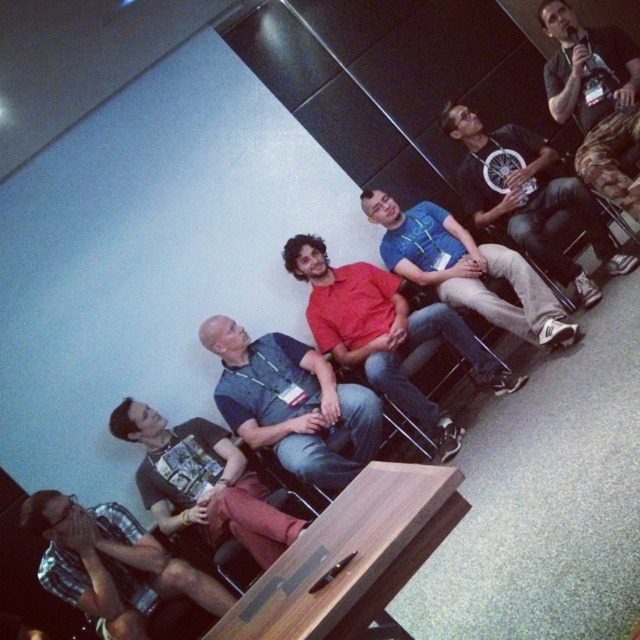
Question: Is dark gray shirt at center to the left of blue t-shirt at center from the viewer's perspective?

Choices:
 (A) yes
 (B) no

Answer: (A)

Question: Among these objects, which one is farthest from the camera?

Choices:
 (A) matte red shirt at center
 (B) matte black shirt at upper right
 (C) blue t-shirt at center
 (D) dark gray shirt at center

Answer: (A)

Question: Does checkered fabric shirt at lower left have a lesser width compared to plaid shirt at lower left?

Choices:
 (A) no
 (B) yes

Answer: (B)

Question: Does matte red shirt at center appear under checkered fabric shirt at lower left?

Choices:
 (A) yes
 (B) no

Answer: (B)

Question: Which of these objects is positioned closest to the matte black shirt at center?

Choices:
 (A) plaid shirt at lower left
 (B) blue t-shirt at center
 (C) matte black shirt at upper right

Answer: (B)

Question: Which point is closer to the camera?

Choices:
 (A) (228, 522)
 (B) (448, 337)
 (C) (140, 532)
 (D) (346, 404)

Answer: (A)